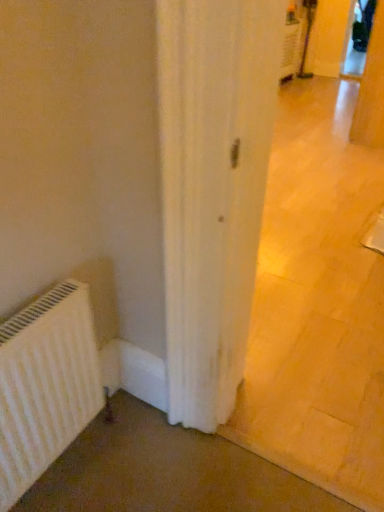
Where is `white glossy door at center`? Image resolution: width=384 pixels, height=512 pixels. white glossy door at center is located at coordinates (371, 89).

What do you see at coordinates (371, 89) in the screenshot? I see `white glossy door at center` at bounding box center [371, 89].

What is the approximate height of white glossy door at center?

The height of white glossy door at center is 3.85 feet.

At what (x,y) coordinates should I click in order to perform the action: click on white glossy door at center. Please return your answer as a coordinate pair (x, y). The height and width of the screenshot is (512, 384). Looking at the image, I should click on (371, 89).